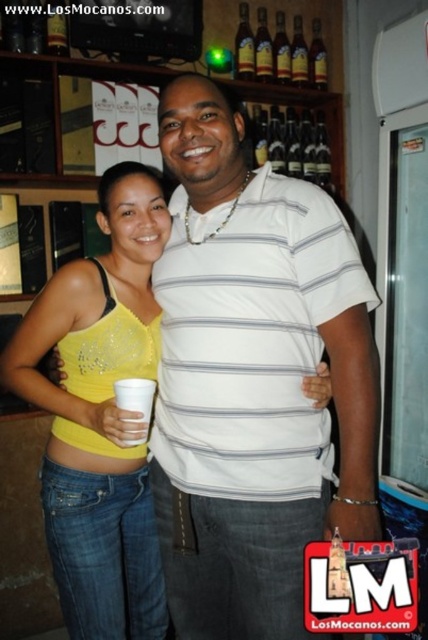
I want to click on brown glass bottles at upper center, so click(x=279, y=51).

Can you confirm if brown glass bottles at upper center is wider than clear glass wine at upper center?

Correct, the width of brown glass bottles at upper center exceeds that of clear glass wine at upper center.

Does point (264, 26) come closer to viewer compared to point (262, 138)?

Yes, it is in front of point (262, 138).

This screenshot has width=428, height=640. Find the location of `brown glass bottles at upper center`. brown glass bottles at upper center is located at coordinates (279, 51).

Does brown glass bottles at upper center appear under white paper cup at lower left?

Incorrect, brown glass bottles at upper center is not positioned below white paper cup at lower left.

Image resolution: width=428 pixels, height=640 pixels. What are the coordinates of `brown glass bottles at upper center` in the screenshot? It's located at (279, 51).

Can you confirm if yellow sequined tank top at center is positioned to the left of brown glass bottle at upper center?

Indeed, yellow sequined tank top at center is positioned on the left side of brown glass bottle at upper center.

Which of these two, yellow sequined tank top at center or brown glass bottle at upper center, stands taller?

yellow sequined tank top at center is taller.

Does point (160, 628) come farther from viewer compared to point (240, 58)?

No, (160, 628) is closer to viewer.

At what (x,y) coordinates should I click in order to perform the action: click on yellow sequined tank top at center. Please return your answer as a coordinate pair (x, y). The width and height of the screenshot is (428, 640). Looking at the image, I should click on (100, 416).